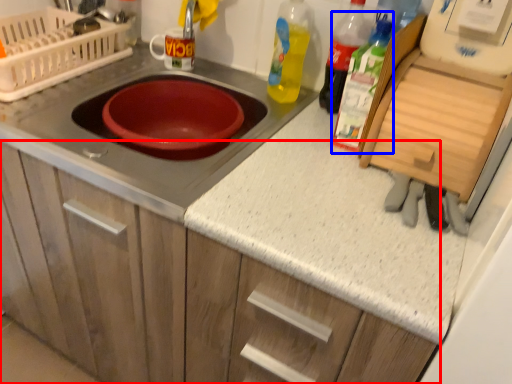
Question: Which object appears closest to the camera in this image, cabinetry (highlighted by a red box) or bottle (highlighted by a blue box)?

Choices:
 (A) cabinetry
 (B) bottle

Answer: (A)